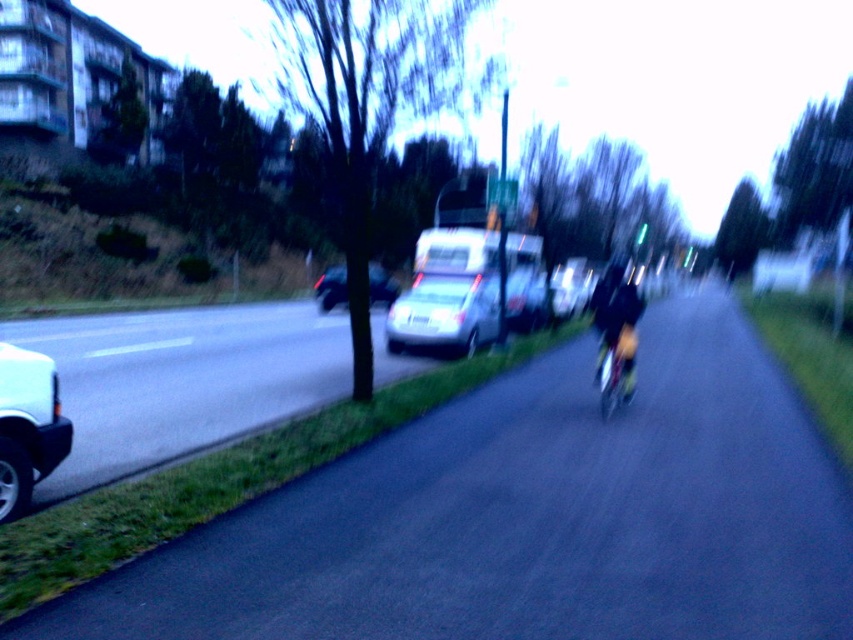
Question: Which object appears farthest from the camera in this image?

Choices:
 (A) metallic silver van at center
 (B) dark gray matte van at center

Answer: (A)

Question: Which object is farther from the camera taking this photo?

Choices:
 (A) satin silver sedan at center
 (B) black matte helmet at center-right

Answer: (A)

Question: Which object is positioned closest to the dark blue fabric jacket at center-right?

Choices:
 (A) shiny blue bicycle at center-right
 (B) satin silver sedan at center
 (C) metallic silver van at center
 (D) dark gray matte van at center

Answer: (A)

Question: Is white matte car at left wider than metallic silver van at center?

Choices:
 (A) no
 (B) yes

Answer: (A)

Question: Can you confirm if satin silver sedan at center is positioned to the right of metallic silver van at center?

Choices:
 (A) yes
 (B) no

Answer: (B)

Question: Where is metallic silver van at center located in relation to black matte helmet at center-right in the image?

Choices:
 (A) left
 (B) right

Answer: (A)